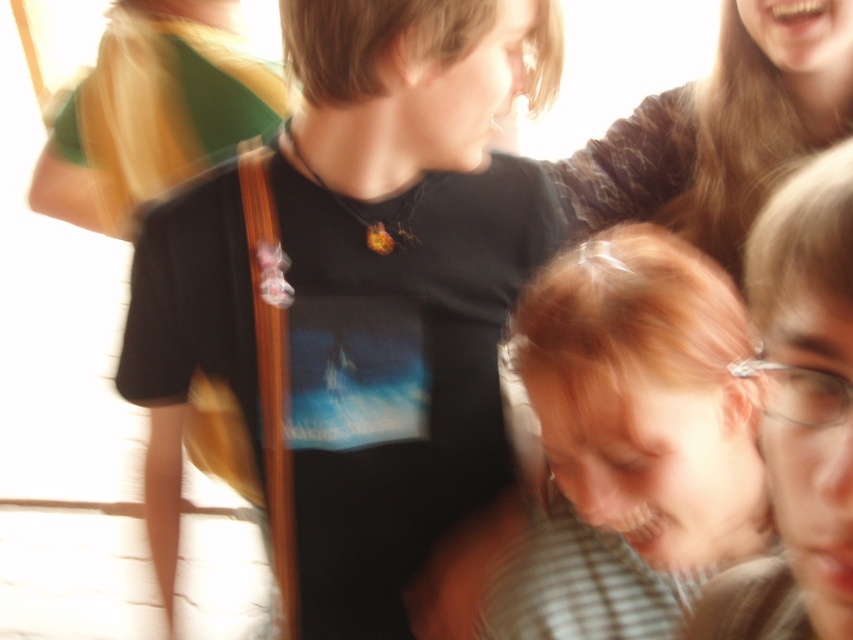
Question: Which object appears closest to the camera in this image?

Choices:
 (A) blonde hair at lower right
 (B) black t-shirt at center

Answer: (A)

Question: Can you confirm if blonde hair at lower right is positioned to the right of blonde hair at upper right?

Choices:
 (A) yes
 (B) no

Answer: (B)

Question: Can you confirm if black t-shirt at center is smaller than blonde hair at upper right?

Choices:
 (A) no
 (B) yes

Answer: (A)

Question: Does blonde hair at lower right appear over blonde hair at upper right?

Choices:
 (A) no
 (B) yes

Answer: (A)

Question: Estimate the real-world distances between objects in this image. Which object is closer to the blonde hair at lower right?

Choices:
 (A) blonde hair at upper right
 (B) black t-shirt at center

Answer: (B)

Question: Which of the following is the farthest from the observer?

Choices:
 (A) blonde hair at lower right
 (B) black t-shirt at center
 (C) blonde hair at upper right

Answer: (C)